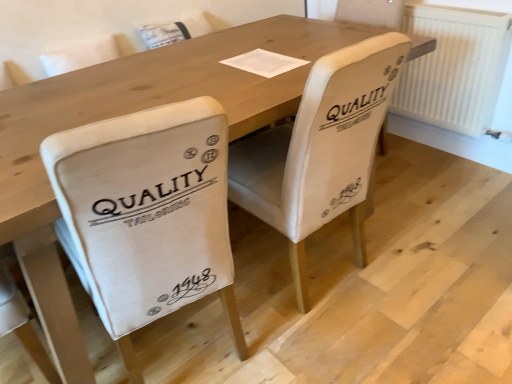
At what (x,y) coordinates should I click in order to perform the action: click on vacant space behind white paper at center. Please return your answer as a coordinate pair (x, y). Looking at the image, I should click on (244, 43).